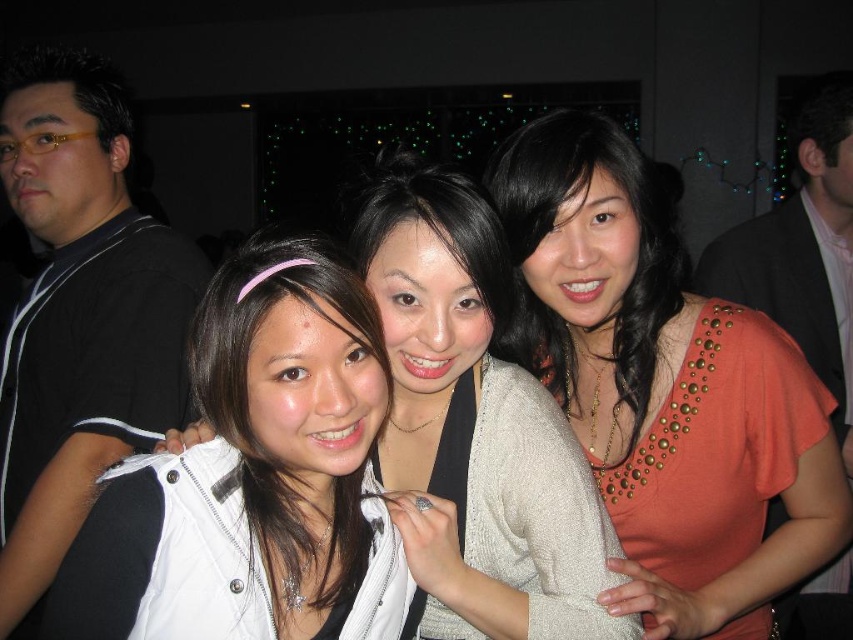
You are at a party and want to take a photo of the orange studded top at center and the white fabric jacket at center. Which one is taller in the image?

The orange studded top at center is much taller than the white fabric jacket at center.